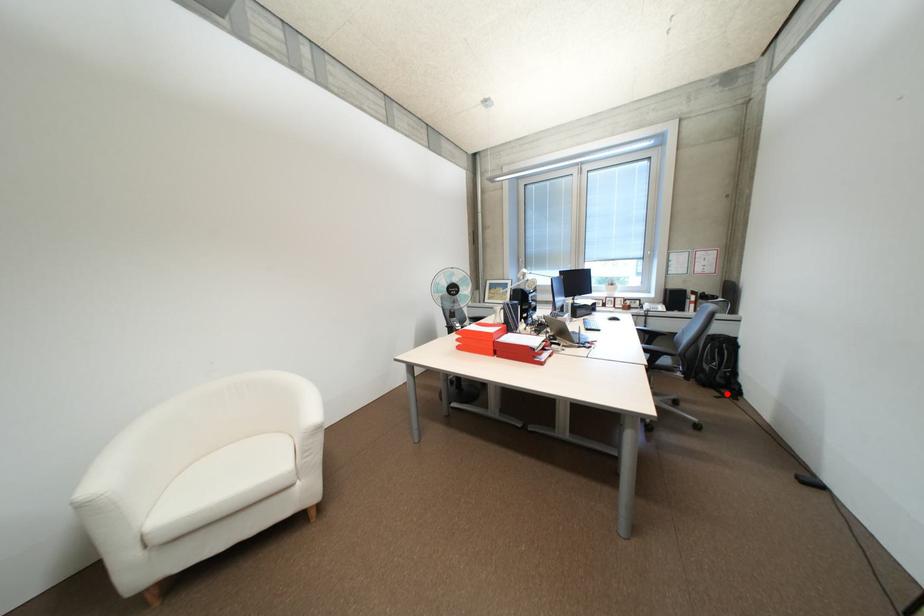
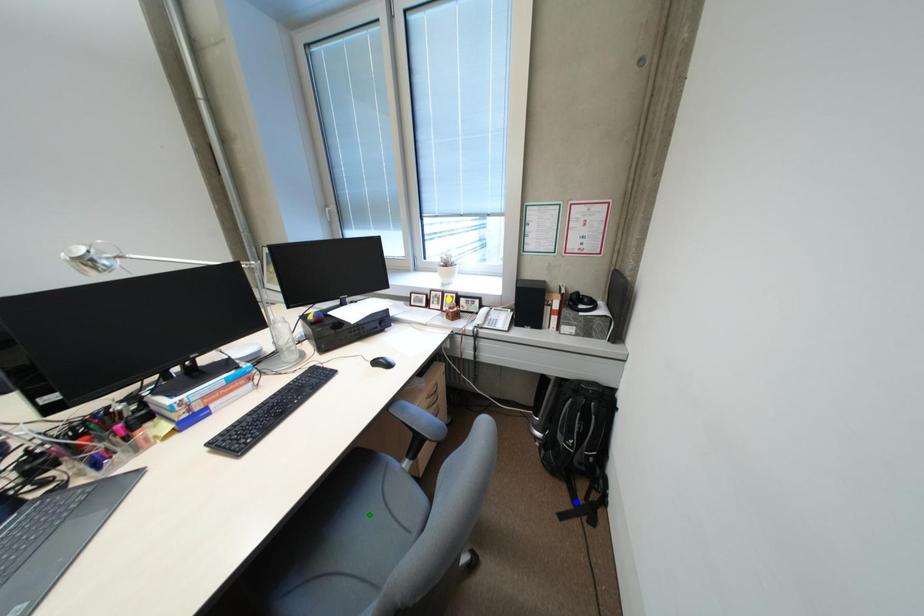
Question: I am providing you with two images of the same scene from different viewpoints. A red point is marked on the first image. You are given multiple points on the second image. Which mark in image 2 goes with the point in image 1?

Choices:
 (A) blue point
 (B) green point
 (C) yellow point

Answer: (A)